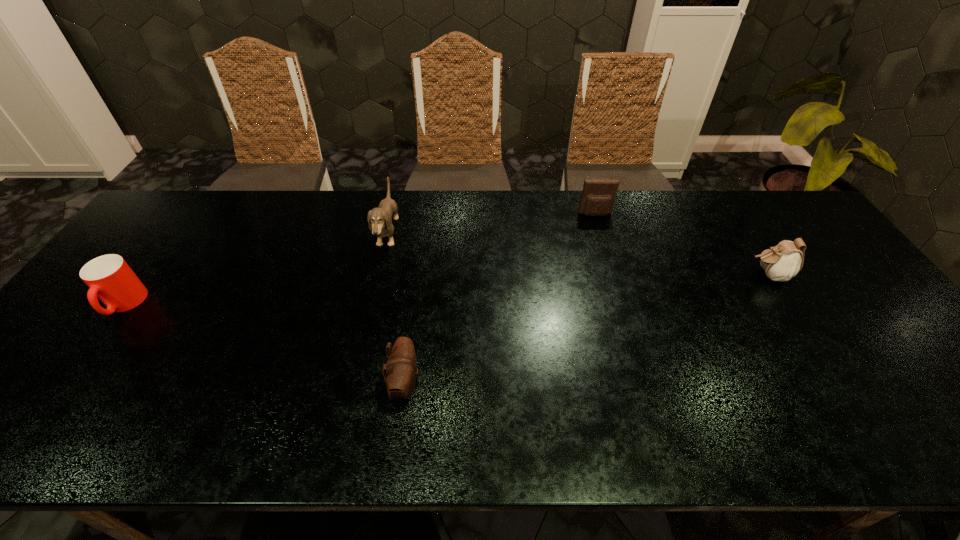
Image resolution: width=960 pixels, height=540 pixels. Identify the location of empty location between the leftmost pouch and the farthest pouch. (500, 300).

This screenshot has width=960, height=540. Find the location of `vacant region between the nearest pouch and the rightmost pouch`. vacant region between the nearest pouch and the rightmost pouch is located at coordinates (587, 330).

At what (x,y) coordinates should I click in order to perform the action: click on vacant space in between the leftmost object and the farthest pouch. Please return your answer as a coordinate pair (x, y). This screenshot has width=960, height=540. Looking at the image, I should click on (360, 260).

The width and height of the screenshot is (960, 540). Find the location of `vacant area between the third object from right to left and the second pouch from right to left`. vacant area between the third object from right to left and the second pouch from right to left is located at coordinates (500, 300).

Point out which object is positioned as the nearest to the rightmost pouch. Please provide its 2D coordinates. Your answer should be formatted as a tuple, i.e. [(x, y)], where the tuple contains the x and y coordinates of a point satisfying the conditions above.

[(598, 196)]

Identify which object is the second nearest to the rightmost pouch. Please provide its 2D coordinates. Your answer should be formatted as a tuple, i.e. [(x, y)], where the tuple contains the x and y coordinates of a point satisfying the conditions above.

[(401, 368)]

Image resolution: width=960 pixels, height=540 pixels. Find the location of `the third closest pouch to the leftmost object`. the third closest pouch to the leftmost object is located at coordinates (782, 262).

What are the coordinates of `pouch that is the third closest one to the leftmost object` in the screenshot? It's located at (782, 262).

This screenshot has width=960, height=540. I want to click on vacant space that satisfies the following two spatial constraints: 1. on the front-facing side of the second farthest pouch; 2. on the side of the leftmost object with the handle, so click(x=787, y=305).